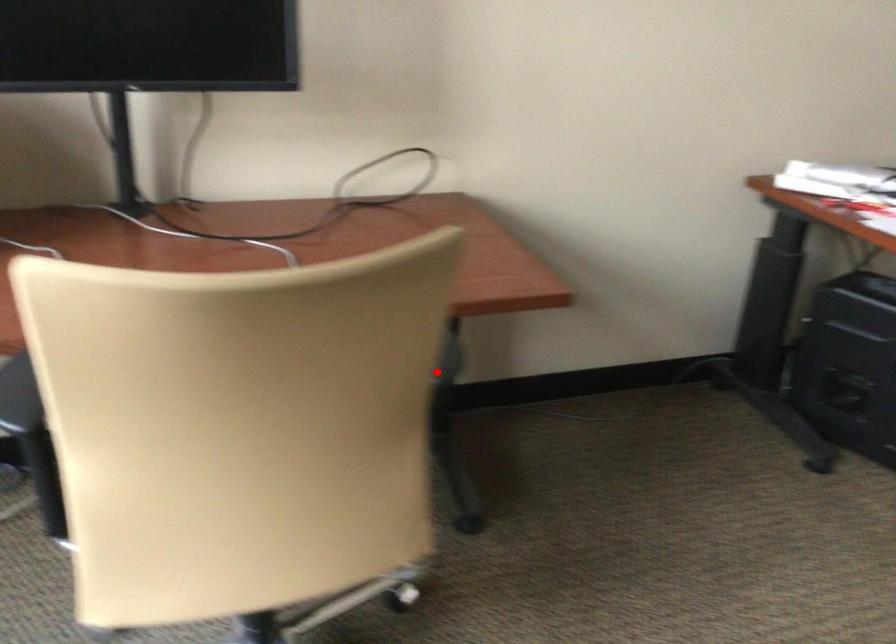
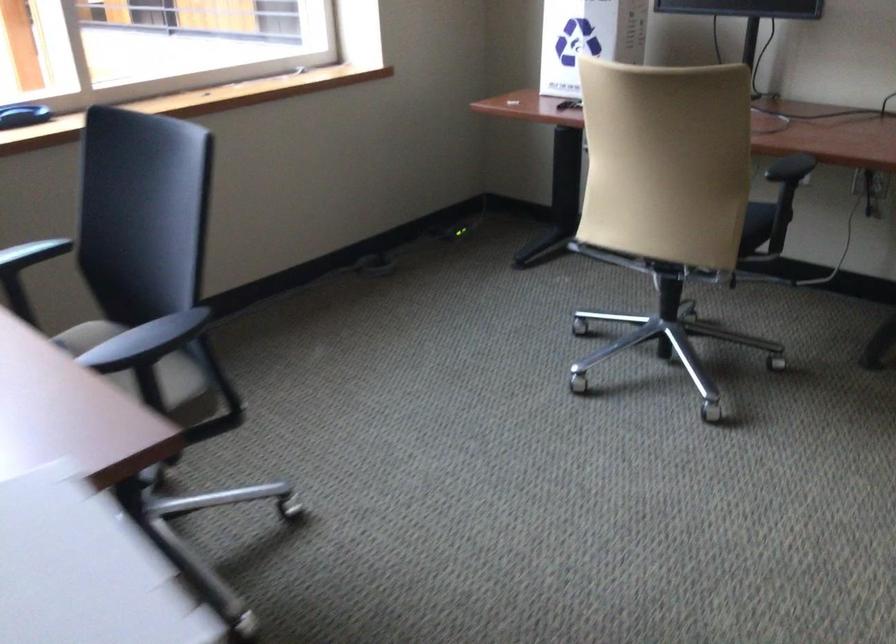
Where in the second image is the point corresponding to the highlighted location from the first image?

(790, 167)